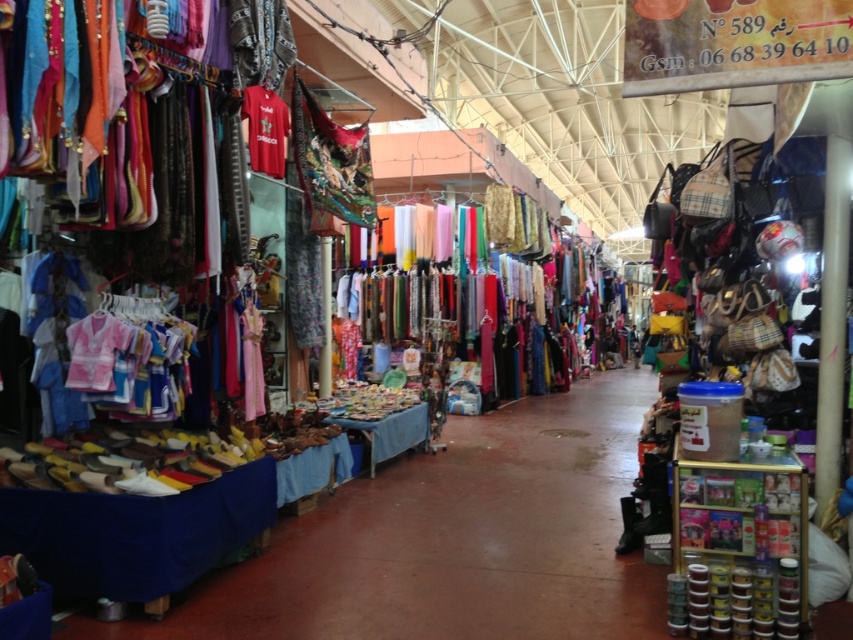
Please look at the image of the market. There is a point at coordinate [447,282]. What object is located at that point?

The silky chiffon dresses at center are represented by the point at coordinate [447,282].

Based on the photo, what are the coordinates of the silky chiffon dresses at center?

The silky chiffon dresses at center are located at point (x=447, y=282).